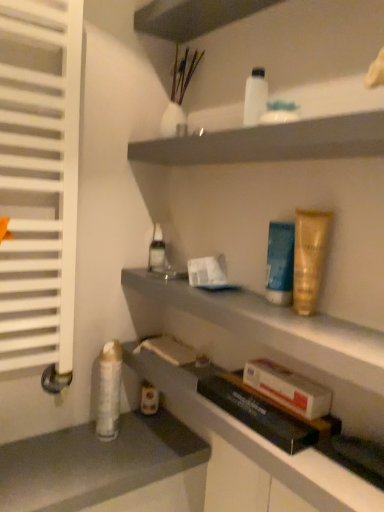
Find the location of a particular element. The height and width of the screenshot is (512, 384). white glossy spray can at lower left, the 1th toiletry positioned from the bottom is located at coordinates (109, 391).

Measure the distance between white glossy spray can at lower left, the first toiletry in the left-to-right sequence, and camera.

white glossy spray can at lower left, the first toiletry in the left-to-right sequence, and camera are 37.54 inches apart.

In order to face gray matte counter at lower left, should I rotate leftwards or rightwards?

Rotate your view left by about 12.281°.

Where is `gray matte counter at lower left`? gray matte counter at lower left is located at coordinates tap(107, 469).

Measure the distance between white glossy lotion at upper center, arranged as the third toiletry when viewed from the back, and camera.

They are 75.65 centimeters apart.

Locate an element on the screen. The height and width of the screenshot is (512, 384). translucent glass bottle at center, which appears as the first toiletry when viewed from the back is located at coordinates (157, 249).

From a real-world perspective, is translucent glass bottle at center, the 2th toiletry viewed from the left, under matte gray shelf at lower center, which appears as the second shelf when viewed from the top?

Actually, translucent glass bottle at center, the 2th toiletry viewed from the left, is physically above matte gray shelf at lower center, which appears as the second shelf when viewed from the top, in the real world.

Between translucent glass bottle at center, positioned as the 4th toiletry in bottom-to-top order, and matte gray shelf at lower center, which appears as the second shelf when viewed from the top, which one is positioned behind?

translucent glass bottle at center, positioned as the 4th toiletry in bottom-to-top order, is further from the camera.

There is a matte gray shelf at lower center, which appears as the second shelf when viewed from the top. Identify the location of the 3rd toiletry above it (from the image's perspective). (157, 249).

Is translucent glass bottle at center, which appears as the first toiletry when viewed from the back, located outside matte gray shelf at lower center, the first shelf from the bottom?

Indeed, translucent glass bottle at center, which appears as the first toiletry when viewed from the back, is completely outside matte gray shelf at lower center, the first shelf from the bottom.

Can you confirm if blue matte tube at center-right, the fourth toiletry when ordered from left to right, is wider than white glossy shelf at upper center, the second shelf in the bottom-to-top sequence?

In fact, blue matte tube at center-right, the fourth toiletry when ordered from left to right, might be narrower than white glossy shelf at upper center, the second shelf in the bottom-to-top sequence.

Would you say blue matte tube at center-right, which is counted as the second toiletry, starting from the bottom, is a long distance from white glossy shelf at upper center, which appears as the 1th shelf when viewed from the top?

blue matte tube at center-right, which is counted as the second toiletry, starting from the bottom, is actually quite close to white glossy shelf at upper center, which appears as the 1th shelf when viewed from the top.

From a real-world perspective, who is located higher, blue matte tube at center-right, the fourth toiletry when ordered from top to bottom, or white glossy shelf at upper center, the second shelf in the bottom-to-top sequence?

From a 3D spatial view, white glossy shelf at upper center, the second shelf in the bottom-to-top sequence, is above.

Is point (273, 281) in front of point (244, 130)?

No, (273, 281) is further to viewer.

Which is less distant, (109, 416) or (158, 440)?

Point (109, 416) is closer to the camera than point (158, 440).

From a real-world perspective, is white glossy spray can at lower left, the fifth toiletry when ordered from top to bottom, located higher than gray matte counter at lower left?

Yes.

How much distance is there between white glossy spray can at lower left, the fifth toiletry when ordered from top to bottom, and gray matte counter at lower left?

The distance of white glossy spray can at lower left, the fifth toiletry when ordered from top to bottom, from gray matte counter at lower left is 5.30 inches.

Based on the photo, considering their positions, is white glossy spray can at lower left, which ranks as the 4th toiletry in front-to-back order, located in front of or behind gray matte counter at lower left?

white glossy spray can at lower left, which ranks as the 4th toiletry in front-to-back order, is behind gray matte counter at lower left.

From their relative heights in the image, would you say translucent glass bottle at center, which ranks as the 2th toiletry in top-to-bottom order, is taller or shorter than white glossy shelf at upper center, the second shelf in the bottom-to-top sequence?

translucent glass bottle at center, which ranks as the 2th toiletry in top-to-bottom order, is taller than white glossy shelf at upper center, the second shelf in the bottom-to-top sequence.

Considering the positions of objects translucent glass bottle at center, the 2th toiletry viewed from the left, and white glossy shelf at upper center, the second shelf in the bottom-to-top sequence, in the image provided, who is more to the left, translucent glass bottle at center, the 2th toiletry viewed from the left, or white glossy shelf at upper center, the second shelf in the bottom-to-top sequence,?

Positioned to the left is translucent glass bottle at center, the 2th toiletry viewed from the left.

Does translucent glass bottle at center, which ranks as the 2th toiletry in top-to-bottom order, turn towards white glossy shelf at upper center, which appears as the 1th shelf when viewed from the top?

No, translucent glass bottle at center, which ranks as the 2th toiletry in top-to-bottom order, is not facing towards white glossy shelf at upper center, which appears as the 1th shelf when viewed from the top.

Which point is more forward, (151,261) or (342,135)?

Point (342,135)

Which is in front, point (118, 381) or point (324, 218)?

The point (324, 218) is closer to the camera.

Considering the sizes of white glossy spray can at lower left, the first toiletry in the left-to-right sequence, and gold metallic tube at upper right, arranged as the 3th toiletry when viewed from the top, in the image, is white glossy spray can at lower left, the first toiletry in the left-to-right sequence, taller or shorter than gold metallic tube at upper right, arranged as the 3th toiletry when viewed from the top,?

In the image, white glossy spray can at lower left, the first toiletry in the left-to-right sequence, appears to be taller than gold metallic tube at upper right, arranged as the 3th toiletry when viewed from the top.

Is white glossy spray can at lower left, the 1th toiletry positioned from the bottom, aimed at gold metallic tube at upper right, which is the first toiletry from right to left?

No, white glossy spray can at lower left, the 1th toiletry positioned from the bottom, is not facing towards gold metallic tube at upper right, which is the first toiletry from right to left.

Is white glossy shelf at upper center, which appears as the 1th shelf when viewed from the top, not near gold metallic tube at upper right, the 5th toiletry viewed from the left?

Actually, white glossy shelf at upper center, which appears as the 1th shelf when viewed from the top, and gold metallic tube at upper right, the 5th toiletry viewed from the left, are a little close together.

From the image's perspective, is white glossy shelf at upper center, the second shelf in the bottom-to-top sequence, located above or below gold metallic tube at upper right, arranged as the 3th toiletry when viewed from the top?

white glossy shelf at upper center, the second shelf in the bottom-to-top sequence, is above gold metallic tube at upper right, arranged as the 3th toiletry when viewed from the top.

Can you confirm if white glossy shelf at upper center, the second shelf in the bottom-to-top sequence, is thinner than gold metallic tube at upper right, which is counted as the third toiletry, starting from the bottom?

No.

Considering the positions of points (372, 135) and (311, 311), is point (372, 135) farther from camera compared to point (311, 311)?

No, it is not.

How far apart are gold metallic tube at upper right, acting as the 1th toiletry starting from the front, and white glossy lotion at upper center, which is the 1th toiletry from top to bottom?

gold metallic tube at upper right, acting as the 1th toiletry starting from the front, and white glossy lotion at upper center, which is the 1th toiletry from top to bottom, are 10.07 inches apart.

Is gold metallic tube at upper right, acting as the 5th toiletry starting from the back, bigger or smaller than white glossy lotion at upper center, which is the 1th toiletry from top to bottom?

Considering their sizes, gold metallic tube at upper right, acting as the 5th toiletry starting from the back, takes up more space than white glossy lotion at upper center, which is the 1th toiletry from top to bottom.

Is white glossy lotion at upper center, acting as the third toiletry starting from the left, at the back of gold metallic tube at upper right, which is the first toiletry from right to left?

No, gold metallic tube at upper right, which is the first toiletry from right to left, is not facing away from white glossy lotion at upper center, acting as the third toiletry starting from the left.

Are gold metallic tube at upper right, which is the first toiletry from right to left, and white glossy lotion at upper center, which is the 1th toiletry from top to bottom, located far from each other?

gold metallic tube at upper right, which is the first toiletry from right to left, is actually quite close to white glossy lotion at upper center, which is the 1th toiletry from top to bottom.

From the translucent glass bottle at center, the 2th toiletry viewed from the left, count 1st shelfs forward and point to it. Please provide its 2D coordinates.

[(281, 333)]

In order to click on shelf located on the right of blue matte tube at center-right, which is counted as the second toiletry, starting from the bottom in this screenshot , I will do `click(271, 142)`.

Considering their positions, is gold metallic tube at upper right, which is counted as the third toiletry, starting from the bottom, positioned closer to blue matte tube at center-right, which is the 2th toiletry in front-to-back order, than white glossy shelf at upper center, which appears as the 1th shelf when viewed from the top?

gold metallic tube at upper right, which is counted as the third toiletry, starting from the bottom, is positioned closer to the anchor blue matte tube at center-right, which is the 2th toiletry in front-to-back order.

Estimate the real-world distances between objects in this image. Which object is further from white glossy shelf at upper center, the second shelf in the bottom-to-top sequence, white cardboard box at lower center or gray matte counter at lower left?

gray matte counter at lower left is further to white glossy shelf at upper center, the second shelf in the bottom-to-top sequence.

In the scene shown: Based on their spatial positions, is white glossy lotion at upper center, positioned as the third toiletry in right-to-left order, or gray matte counter at lower left closer to white cardboard box at lower center?

gray matte counter at lower left.

Which object lies nearer to the anchor point white glossy shelf at upper center, the second shelf in the bottom-to-top sequence, white glossy spray can at lower left, which ranks as the 4th toiletry in front-to-back order, or gold metallic tube at upper right, which is counted as the third toiletry, starting from the bottom?

gold metallic tube at upper right, which is counted as the third toiletry, starting from the bottom, lies closer to white glossy shelf at upper center, the second shelf in the bottom-to-top sequence, than the other object.

Estimate the real-world distances between objects in this image. Which object is further from white cardboard box at lower center, white glossy shelf at upper center, which appears as the 1th shelf when viewed from the top, or blue matte tube at center-right, which is counted as the second toiletry, starting from the bottom?

white glossy shelf at upper center, which appears as the 1th shelf when viewed from the top, is positioned further to the anchor white cardboard box at lower center.

Which object lies nearer to the anchor point blue matte tube at center-right, placed as the fourth toiletry when sorted from back to front, gold metallic tube at upper right, which is the first toiletry from right to left, or translucent glass bottle at center, the 2th toiletry viewed from the left?

gold metallic tube at upper right, which is the first toiletry from right to left, lies closer to blue matte tube at center-right, placed as the fourth toiletry when sorted from back to front, than the other object.

When comparing their distances from matte gray shelf at lower center, the first shelf from the bottom, does blue matte tube at center-right, which is counted as the second toiletry, starting from the bottom, or white cardboard box at lower center seem closer?

white cardboard box at lower center is positioned closer to the anchor matte gray shelf at lower center, the first shelf from the bottom.

Considering their positions, is matte gray shelf at lower center, the first shelf from the bottom, positioned closer to translucent glass bottle at center, which is the fifth toiletry from front to back, than white cardboard box at lower center?

Among the two, matte gray shelf at lower center, the first shelf from the bottom, is located nearer to translucent glass bottle at center, which is the fifth toiletry from front to back.

Locate an element on the screen. Image resolution: width=384 pixels, height=512 pixels. product located between white glossy spray can at lower left, the second toiletry positioned from the back, and gold metallic tube at upper right, which is the first toiletry from right to left, in the left-right direction is located at coordinates (288, 388).

The image size is (384, 512). What are the coordinates of `shelf between white glossy shelf at upper center, which appears as the 1th shelf when viewed from the top, and white glossy spray can at lower left, the 1th toiletry positioned from the bottom, in the up-down direction` in the screenshot? It's located at (281, 333).

Locate an element on the screen. The image size is (384, 512). shelf between white glossy shelf at upper center, which appears as the 1th shelf when viewed from the top, and translucent glass bottle at center, the 2th toiletry viewed from the left, from front to back is located at coordinates (281, 333).

Find the location of a particular element. This screenshot has width=384, height=512. product situated between gray matte counter at lower left and gold metallic tube at upper right, acting as the 1th toiletry starting from the front, from left to right is located at coordinates (288, 388).